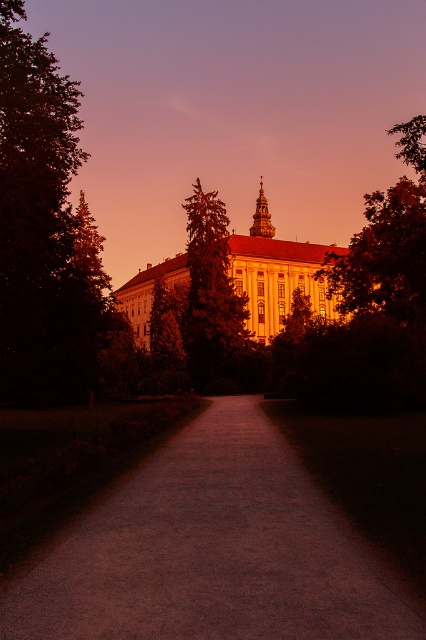
Who is more forward, (276, 294) or (195, 228)?

Point (195, 228) is more forward.

Which of these two, golden stone palace at center or green leafy tree at center, stands taller?

With more height is golden stone palace at center.

The image size is (426, 640). I want to click on golden stone palace at center, so click(x=276, y=273).

Does dusty gravel path at center appear under golden stone palace at center?

Yes.

Does dusty gravel path at center have a greater height compared to golden stone palace at center?

No.

Is point (100, 545) positioned in front of point (299, 250)?

Yes, point (100, 545) is in front of point (299, 250).

At what (x,y) coordinates should I click in order to perform the action: click on dusty gravel path at center. Please return your answer as a coordinate pair (x, y). Looking at the image, I should click on (209, 552).

Is dusty gravel path at center further to the viewer compared to green leafy tree at center?

No.

Can you confirm if dusty gravel path at center is thinner than green leafy tree at center?

Yes.

Is point (351, 572) more distant than point (181, 316)?

No.

Where is `dusty gravel path at center`? dusty gravel path at center is located at coordinates (209, 552).